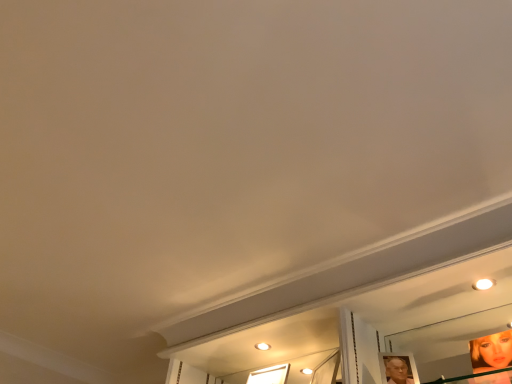
Question: From the image's perspective, is shiny gold mirror at lower right above or below transparent glass window at center?

Choices:
 (A) above
 (B) below

Answer: (A)

Question: Would you say shiny gold mirror at lower right is to the left or to the right of transparent glass window at center in the picture?

Choices:
 (A) left
 (B) right

Answer: (B)

Question: From a real-world perspective, is shiny gold mirror at lower right positioned above or below transparent glass window at center?

Choices:
 (A) below
 (B) above

Answer: (A)

Question: Considering the positions of transparent glass window at center and shiny gold mirror at lower right in the image, is transparent glass window at center taller or shorter than shiny gold mirror at lower right?

Choices:
 (A) short
 (B) tall

Answer: (A)

Question: Considering the positions of point (259, 369) and point (457, 344), is point (259, 369) closer or farther from the camera than point (457, 344)?

Choices:
 (A) farther
 (B) closer

Answer: (A)

Question: From the image's perspective, is transparent glass window at center positioned above or below shiny gold mirror at lower right?

Choices:
 (A) below
 (B) above

Answer: (A)

Question: Do you think transparent glass window at center is within shiny gold mirror at lower right, or outside of it?

Choices:
 (A) outside
 (B) inside

Answer: (A)